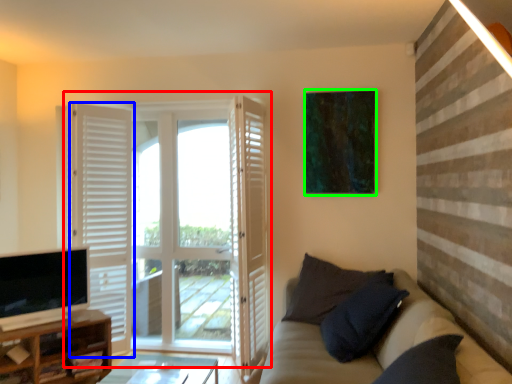
Question: Which object is positioned farthest from door (highlighted by a red box)? Select from door (highlighted by a blue box) and picture frame (highlighted by a green box).

Choices:
 (A) door
 (B) picture frame

Answer: (B)